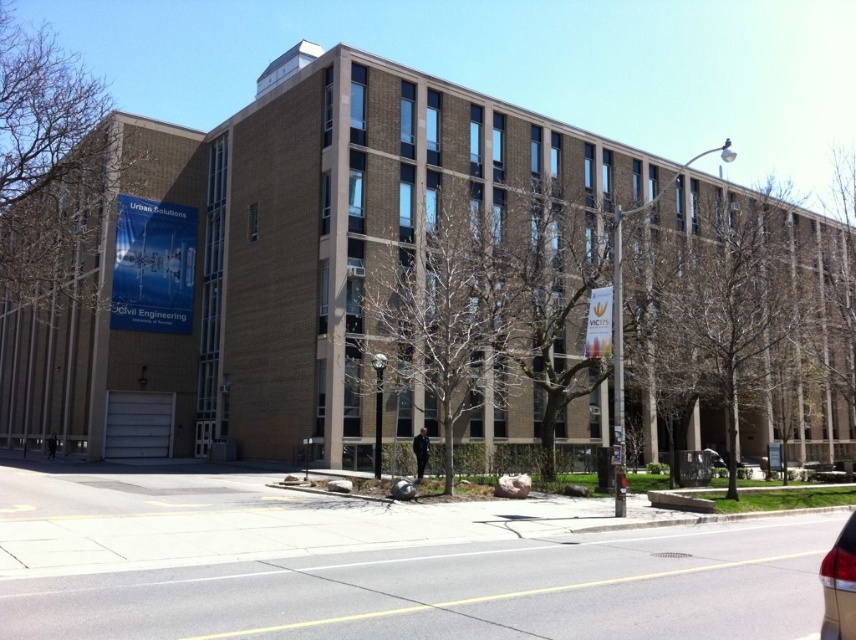
In the scene shown: You are standing on the sidewalk in front of the brown brick building at center and want to see the shiny red tail light at lower right. Which direction should you look relative to the building?

The brown brick building at center is above the shiny red tail light at lower right, so you should look downward from the building to see the shiny red tail light at lower right.

You are standing in front of the building and want to take a photo. You notice two points marked on the building wall. The first point is at position point (244,138) and the second is at point (840,561). Which point will appear closer to the camera in your photo?

Point (244,138) is further to the camera than point (840,561), so the second point will appear closer to the camera in the photo.